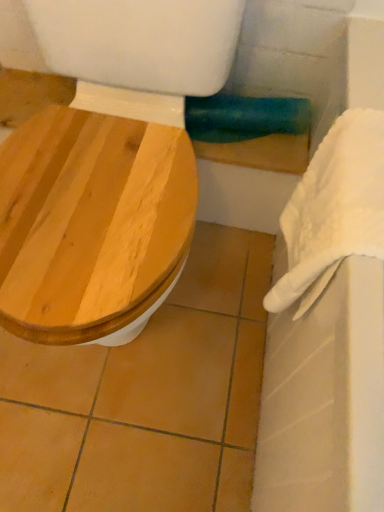
Where is `white fabric towel bar at upper right`? This screenshot has height=512, width=384. white fabric towel bar at upper right is located at coordinates [x=244, y=117].

You are a GUI agent. You are given a task and a screenshot of the screen. Output one action in this format:
    pyautogui.click(x=<x>, y=<y>)
    Task: Click on the white fluffy towel at right
    
    Given the screenshot: What is the action you would take?
    pyautogui.click(x=333, y=209)

Where is `white fabric towel bar at upper right`? white fabric towel bar at upper right is located at coordinates (244, 117).

From a real-world perspective, is white fabric towel bar at upper right positioned above or below white fluffy towel at right?

Clearly, from a real-world perspective, white fabric towel bar at upper right is below white fluffy towel at right.

Between white fabric towel bar at upper right and white fluffy towel at right, which one has larger size?

Bigger between the two is white fluffy towel at right.

Image resolution: width=384 pixels, height=512 pixels. Identify the location of towel bar below the white fluffy towel at right (from a real-world perspective). coord(244,117).

Would you say white fluffy towel at right is to the left or to the right of white fabric towel bar at upper right in the picture?

From the image, it's evident that white fluffy towel at right is to the right of white fabric towel bar at upper right.

What's the angular difference between white fluffy towel at right and white fabric towel bar at upper right's facing directions?

They differ by 89.9 degrees in their facing directions.

Is white fluffy towel at right bigger or smaller than white fabric towel bar at upper right?

white fluffy towel at right is bigger than white fabric towel bar at upper right.

Considering their positions, is white fluffy towel at right located in front of or behind white fabric towel bar at upper right?

In the image, white fluffy towel at right appears in front of white fabric towel bar at upper right.

From the image's perspective, which is below, white fabric towel bar at upper right or wooden toilet seat at left?

wooden toilet seat at left, from the image's perspective.

Is white fabric towel bar at upper right oriented away from wooden toilet seat at left?

No, white fabric towel bar at upper right's orientation is not away from wooden toilet seat at left.

Considering the sizes of white fabric towel bar at upper right and wooden toilet seat at left in the image, is white fabric towel bar at upper right taller or shorter than wooden toilet seat at left?

Clearly, white fabric towel bar at upper right is shorter compared to wooden toilet seat at left.

Can you tell me how much white fabric towel bar at upper right and wooden toilet seat at left differ in facing direction?

They differ by 2.55 degrees in their facing directions.

Is wooden toilet seat at left in contact with white fluffy towel at right?

wooden toilet seat at left and white fluffy towel at right are not in contact.

From a real-world perspective, is wooden toilet seat at left positioned above or below white fluffy towel at right?

From a real-world perspective, wooden toilet seat at left is physically below white fluffy towel at right.

Considering the positions of points (108, 68) and (324, 221), is point (108, 68) farther from camera compared to point (324, 221)?

Yes, point (108, 68) is farther from viewer.

From the image's perspective, is white fluffy towel at right beneath wooden toilet seat at left?

Yes, from the image's perspective, white fluffy towel at right is beneath wooden toilet seat at left.

Considering the positions of objects white fluffy towel at right and wooden toilet seat at left in the image provided, who is behind, white fluffy towel at right or wooden toilet seat at left?

white fluffy towel at right is behind.

Would you say white fluffy towel at right is inside or outside wooden toilet seat at left?

white fluffy towel at right is not enclosed by wooden toilet seat at left.

From a real-world perspective, which is physically below, wooden toilet seat at left or white fabric towel bar at upper right?

In real-world perspective, white fabric towel bar at upper right is lower.

Is wooden toilet seat at left beside white fabric towel bar at upper right?

No, wooden toilet seat at left is not beside white fabric towel bar at upper right.

Considering the sizes of objects wooden toilet seat at left and white fabric towel bar at upper right in the image provided, who is wider, wooden toilet seat at left or white fabric towel bar at upper right?

With larger width is wooden toilet seat at left.

Considering the relative sizes of wooden toilet seat at left and white fabric towel bar at upper right in the image provided, is wooden toilet seat at left shorter than white fabric towel bar at upper right?

In fact, wooden toilet seat at left may be taller than white fabric towel bar at upper right.

Find the location of `towel bar that appears on the left of white fluffy towel at right`. towel bar that appears on the left of white fluffy towel at right is located at coordinates (244, 117).

The image size is (384, 512). What are the coordinates of `towel/napkin that is below the white fabric towel bar at upper right (from the image's perspective)` in the screenshot? It's located at (333, 209).

Considering their positions, is wooden toilet seat at left positioned closer to white fluffy towel at right than white fabric towel bar at upper right?

Among the two, wooden toilet seat at left is located nearer to white fluffy towel at right.

Estimate the real-world distances between objects in this image. Which object is closer to white fluffy towel at right, white fabric towel bar at upper right or wooden toilet seat at left?

wooden toilet seat at left.

Looking at the image, which one is located closer to white fabric towel bar at upper right, wooden toilet seat at left or white fluffy towel at right?

Among the two, wooden toilet seat at left is located nearer to white fabric towel bar at upper right.

Looking at the image, which one is located further to wooden toilet seat at left, white fluffy towel at right or white fabric towel bar at upper right?

white fabric towel bar at upper right.

From the image, which object appears to be farther from wooden toilet seat at left, white fabric towel bar at upper right or white fluffy towel at right?

Based on the image, white fabric towel bar at upper right appears to be further to wooden toilet seat at left.

Estimate the real-world distances between objects in this image. Which object is closer to white fabric towel bar at upper right, white fluffy towel at right or wooden toilet seat at left?

Among the two, wooden toilet seat at left is located nearer to white fabric towel bar at upper right.

You are a GUI agent. You are given a task and a screenshot of the screen. Output one action in this format:
    pyautogui.click(x=<x>, y=<y>)
    Task: Click on the towel/napkin between wooden toilet seat at left and white fabric towel bar at upper right in the front-back direction
    This screenshot has height=512, width=384.
    Given the screenshot: What is the action you would take?
    pyautogui.click(x=333, y=209)